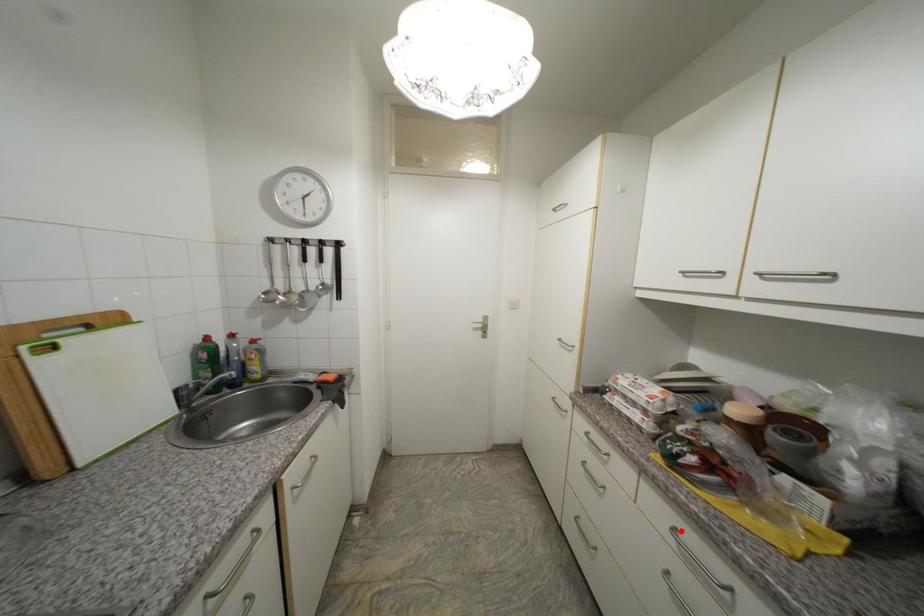
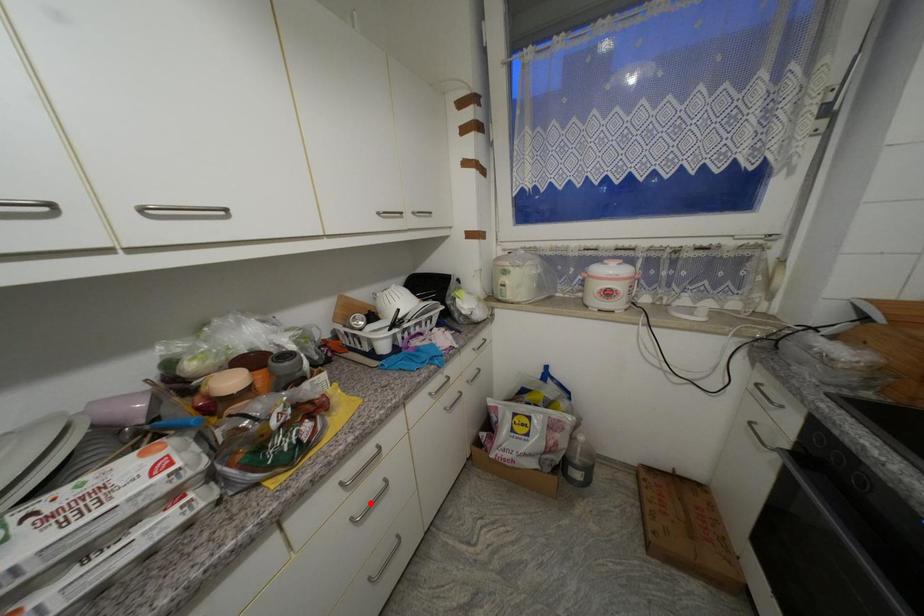
I am providing you with two images of the same scene from different viewpoints. A red point is marked on the first image and another point is marked on the second image. Is the red point in image1 aligned with the point shown in image2?

No